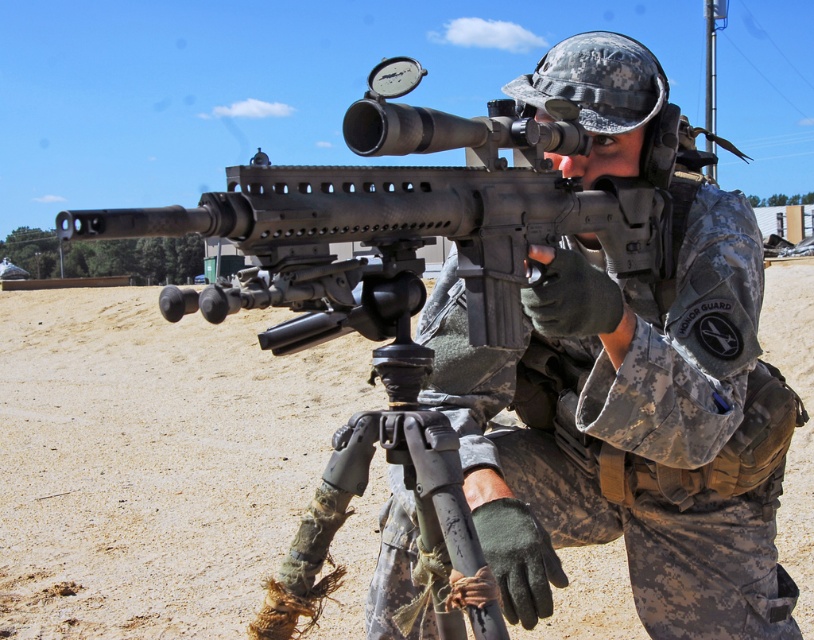
Question: Can you confirm if dirt field at center is thinner than camouflage uniform at center?

Choices:
 (A) yes
 (B) no

Answer: (B)

Question: Considering the relative positions of dirt field at center and camouflage uniform at center in the image provided, where is dirt field at center located with respect to camouflage uniform at center?

Choices:
 (A) above
 (B) below

Answer: (A)

Question: Which point is farther from the camera taking this photo?

Choices:
 (A) (278, 316)
 (B) (506, 513)

Answer: (A)

Question: Which point appears closest to the camera in this image?

Choices:
 (A) (63, 522)
 (B) (594, 474)

Answer: (B)

Question: Observing the image, what is the correct spatial positioning of dirt field at center in reference to camouflage uniform at center?

Choices:
 (A) right
 (B) left

Answer: (B)